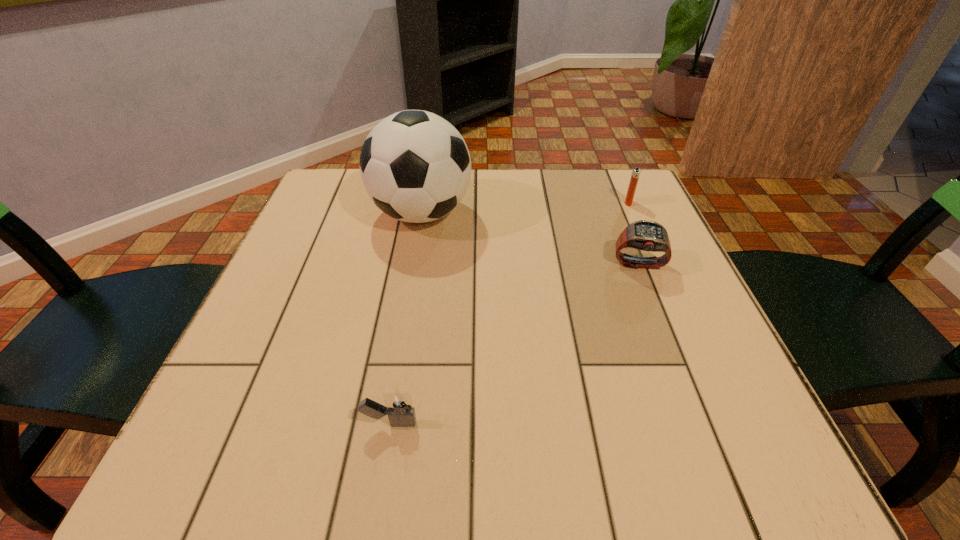
Where is `igniter at the far edge`? igniter at the far edge is located at coordinates (635, 174).

Find the location of a particular element. object at the near edge is located at coordinates (398, 406).

At what (x,y) coordinates should I click in order to perform the action: click on object that is at the left edge. Please return your answer as a coordinate pair (x, y). Looking at the image, I should click on (415, 166).

Find the location of a particular element. The image size is (960, 540). igniter located at the right edge is located at coordinates (635, 174).

The height and width of the screenshot is (540, 960). What are the coordinates of `watch at the right edge` in the screenshot? It's located at (646, 235).

Identify the location of object located in the far left corner section of the desktop. This screenshot has width=960, height=540. (415, 166).

This screenshot has width=960, height=540. I want to click on object at the far right corner, so click(x=635, y=174).

Where is `vacant space at the far edge`? The image size is (960, 540). vacant space at the far edge is located at coordinates (547, 185).

Where is `vacant region at the near edge`? Image resolution: width=960 pixels, height=540 pixels. vacant region at the near edge is located at coordinates pos(575,436).

Locate an element on the screen. vacant space at the left edge of the desktop is located at coordinates (263, 303).